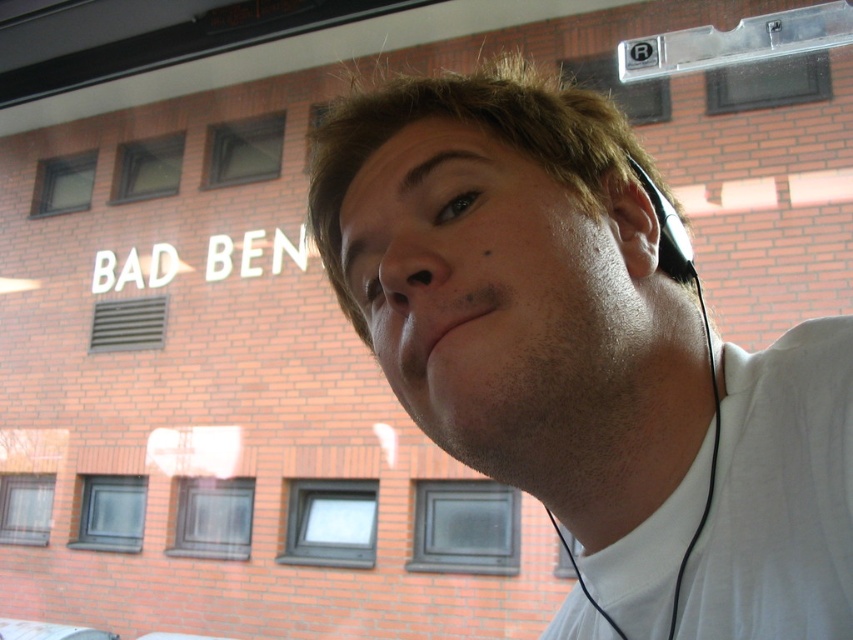
Does white matte shirt at lower right have a greater width compared to metallic vent at upper center?

In fact, white matte shirt at lower right might be narrower than metallic vent at upper center.

You are a GUI agent. You are given a task and a screenshot of the screen. Output one action in this format:
    pyautogui.click(x=<x>, y=<y>)
    Task: Click on the white matte shirt at lower right
    The image size is (853, 640).
    Given the screenshot: What is the action you would take?
    pyautogui.click(x=779, y=496)

Is point (784, 513) positioned after point (107, 307)?

No, (784, 513) is in front of (107, 307).

Where is `white matte shirt at lower right`? Image resolution: width=853 pixels, height=640 pixels. white matte shirt at lower right is located at coordinates (779, 496).

How far apart are white matte shirt at lower right and transparent glass window at upper center?

A distance of 13.25 feet exists between white matte shirt at lower right and transparent glass window at upper center.

Does point (688, 621) come farther from viewer compared to point (753, 84)?

No, (688, 621) is closer to viewer.

You are a GUI agent. You are given a task and a screenshot of the screen. Output one action in this format:
    pyautogui.click(x=<x>, y=<y>)
    Task: Click on the white matte shirt at lower right
    
    Given the screenshot: What is the action you would take?
    pyautogui.click(x=779, y=496)

Who is shorter, dark gray glass window at lower left or clear glass window at lower left?

clear glass window at lower left

Is dark gray glass window at lower left bigger than clear glass window at lower left?

Correct, dark gray glass window at lower left is larger in size than clear glass window at lower left.

Between point (120, 497) and point (48, 497), which one is positioned in front?

Point (120, 497) is in front.

Identify the location of dark gray glass window at lower left. (111, 513).